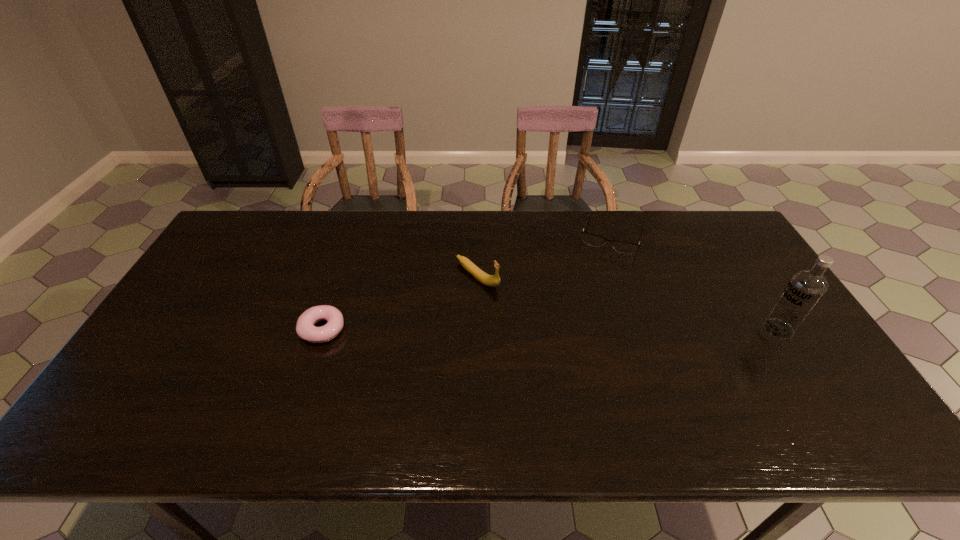
Locate an element on the screen. unoccupied position between the banana and the spectacles is located at coordinates (544, 256).

I want to click on vacant space in between the third object from left to right and the rightmost object, so click(x=695, y=282).

Image resolution: width=960 pixels, height=540 pixels. I want to click on free spot between the rightmost object and the leftmost object, so click(550, 329).

Where is `unoccupied position between the tallest object and the third object from left to right`? unoccupied position between the tallest object and the third object from left to right is located at coordinates (695, 282).

Locate an element on the screen. The image size is (960, 540). vacant area between the leftmost object and the tallest object is located at coordinates (550, 329).

Where is `object that is the third closest to the doughnut`? The height and width of the screenshot is (540, 960). object that is the third closest to the doughnut is located at coordinates (805, 289).

Identify which object is the third closest to the second tallest object. Please provide its 2D coordinates. Your answer should be formatted as a tuple, i.e. [(x, y)], where the tuple contains the x and y coordinates of a point satisfying the conditions above.

[(805, 289)]

The width and height of the screenshot is (960, 540). Find the location of `vacant area in the image that satisfies the following two spatial constraints: 1. on the front side of the doughnut; 2. on the front label of the tallest object`. vacant area in the image that satisfies the following two spatial constraints: 1. on the front side of the doughnut; 2. on the front label of the tallest object is located at coordinates (323, 329).

Locate an element on the screen. The image size is (960, 540). free point that satisfies the following two spatial constraints: 1. on the back side of the second farthest object; 2. on the right side of the spectacles is located at coordinates (478, 235).

At what (x,y) coordinates should I click in order to perform the action: click on vacant area that satisfies the following two spatial constraints: 1. on the back side of the doughnut; 2. on the right side of the farthest object. Please return your answer as a coordinate pair (x, y). The width and height of the screenshot is (960, 540). Looking at the image, I should click on (354, 235).